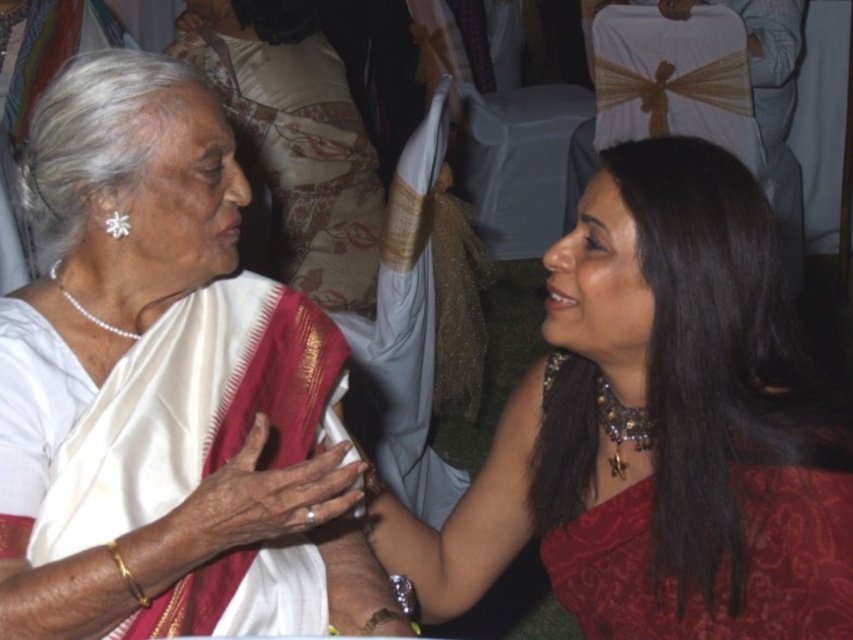
Between matte red saree at center and red satin dress at right, which one appears on the right side from the viewer's perspective?

From the viewer's perspective, red satin dress at right appears more on the right side.

Is point (664, 573) positioned behind point (840, 563)?

Yes, point (664, 573) is behind point (840, 563).

You are a GUI agent. You are given a task and a screenshot of the screen. Output one action in this format:
    pyautogui.click(x=<x>, y=<y>)
    Task: Click on the matte red saree at center
    The height and width of the screenshot is (640, 853).
    Given the screenshot: What is the action you would take?
    pyautogui.click(x=660, y=428)

Between white silk saree at center and red satin dress at right, which one has more height?

white silk saree at center is taller.

Who is positioned more to the right, white silk saree at center or red satin dress at right?

From the viewer's perspective, red satin dress at right appears more on the right side.

Describe the element at coordinates (165, 390) in the screenshot. The image size is (853, 640). I see `white silk saree at center` at that location.

The image size is (853, 640). In order to click on white silk saree at center in this screenshot , I will do `click(165, 390)`.

Between matte red saree at center and white silk saree at upper left, which one appears on the right side from the viewer's perspective?

matte red saree at center

Is matte red saree at center to the right of white silk saree at upper left from the viewer's perspective?

Yes, matte red saree at center is to the right of white silk saree at upper left.

Does point (596, 392) lie behind point (292, 125)?

No, (596, 392) is in front of (292, 125).

Identify the location of matte red saree at center. The image size is (853, 640). (660, 428).